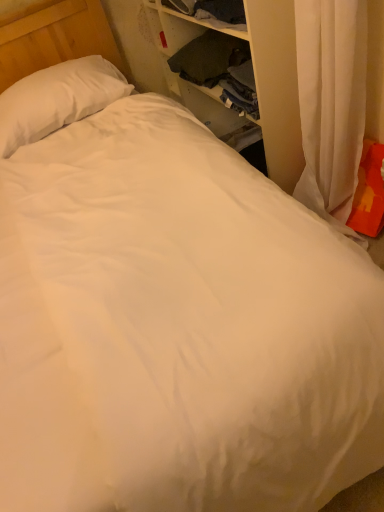
Question: In terms of width, does orange fabric pillow at right, the first pillow viewed from the right, look wider or thinner when compared to wooden dresser at upper right?

Choices:
 (A) thin
 (B) wide

Answer: (A)

Question: Considering the positions of orange fabric pillow at right, arranged as the first pillow when viewed from the front, and wooden dresser at upper right in the image, is orange fabric pillow at right, arranged as the first pillow when viewed from the front, bigger or smaller than wooden dresser at upper right?

Choices:
 (A) small
 (B) big

Answer: (A)

Question: Estimate the real-world distances between objects in this image. Which object is closer to the orange fabric pillow at right, the second pillow when ordered from top to bottom?

Choices:
 (A) wooden dresser at upper right
 (B) white soft pillow at upper left, the 2th pillow positioned from the bottom

Answer: (A)

Question: Based on their relative distances, which object is farther from the orange fabric pillow at right, marked as the 2th pillow in a back-to-front arrangement?

Choices:
 (A) wooden dresser at upper right
 (B) white soft pillow at upper left, which is the second pillow in right-to-left order

Answer: (B)